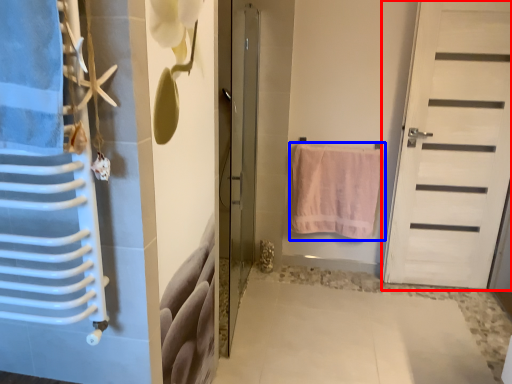
Question: Which of the following is the farthest to the observer, door (highlighted by a red box) or towel (highlighted by a blue box)?

Choices:
 (A) door
 (B) towel

Answer: (B)